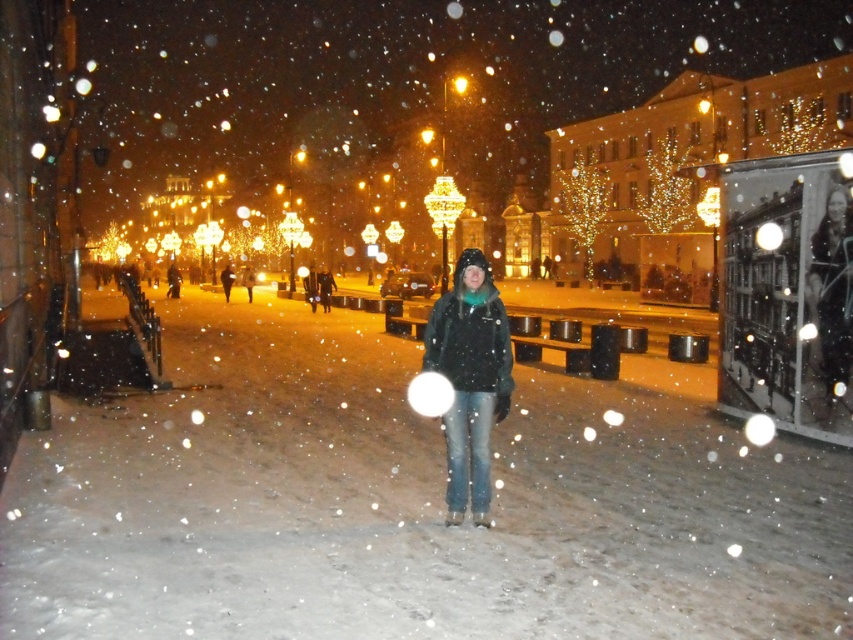
Consider the image. Can you confirm if matte black jacket at center is shorter than dark green jacket at center?

Indeed, matte black jacket at center has a lesser height compared to dark green jacket at center.

Does point (456, 522) lie in front of point (228, 268)?

That is True.

You are a GUI agent. You are given a task and a screenshot of the screen. Output one action in this format:
    pyautogui.click(x=<x>, y=<y>)
    Task: Click on the matte black jacket at center
    
    Given the screenshot: What is the action you would take?
    pyautogui.click(x=469, y=380)